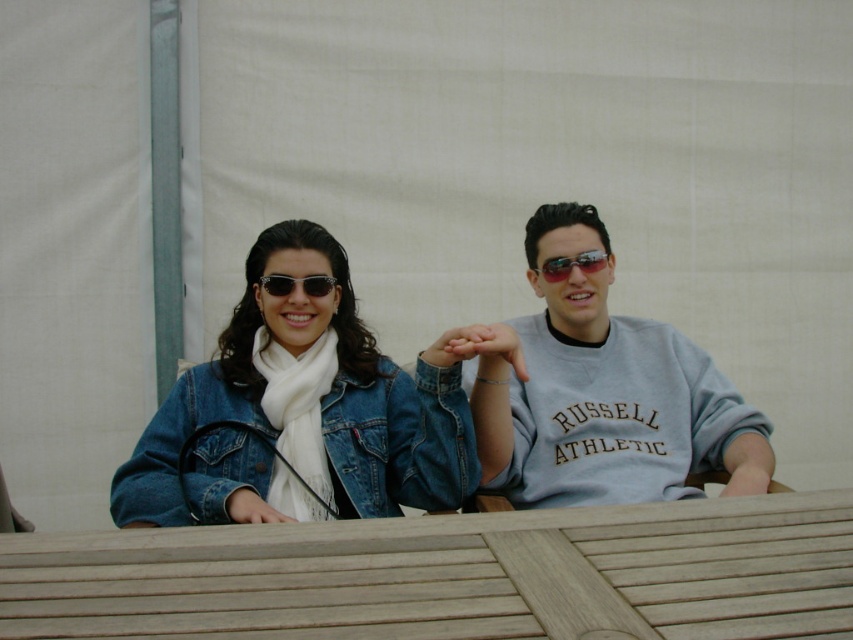
You are a photographer setting up a shoot in front of a plain off white backdrop. You notice the matte gray sweatshirt at center and the matte black sunglasses at center. Which object is positioned lower in the frame?

The matte gray sweatshirt at center is below the matte black sunglasses at center, so it is positioned lower in the frame.

You are a photographer trying to capture a candid shot of the two people in the scene. You notice the denim jacket at center and the sunglasses at center. Which object is positioned lower in the image?

The denim jacket at center is located below the sunglasses at center, so the denim jacket at center is positioned lower in the image.